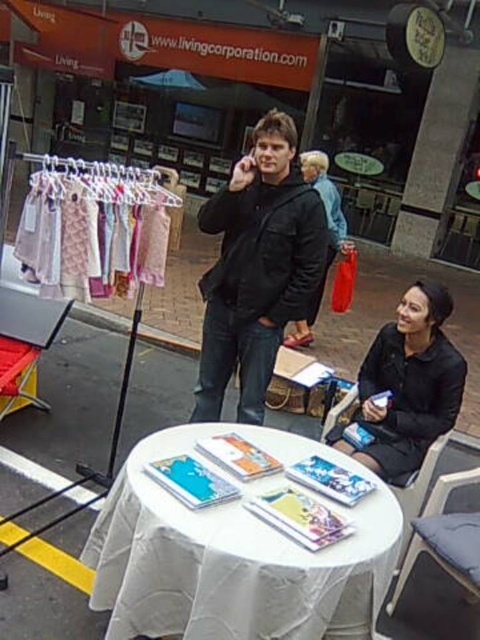
Question: Can you confirm if black matte jacket at center is positioned to the left of black matte dress at lower right?

Choices:
 (A) no
 (B) yes

Answer: (B)

Question: Which object is the closest to the black matte dress at lower right?

Choices:
 (A) black matte jacket at center
 (B) dark gray fabric chair at lower right
 (C) white cloth-covered table at center

Answer: (B)

Question: Which of the following is the closest to the observer?

Choices:
 (A) white cloth-covered table at center
 (B) black matte dress at lower right

Answer: (A)

Question: Which point is farther to the camera?

Choices:
 (A) dark gray fabric chair at lower right
 (B) white cloth-covered table at center
 (C) black matte jacket at center
 (D) black matte dress at lower right

Answer: (C)

Question: Considering the relative positions of white cloth-covered table at center and black matte jacket at center in the image provided, where is white cloth-covered table at center located with respect to black matte jacket at center?

Choices:
 (A) below
 (B) above

Answer: (A)

Question: Can you confirm if black matte jacket at center is positioned below matte black jacket at center?

Choices:
 (A) no
 (B) yes

Answer: (B)